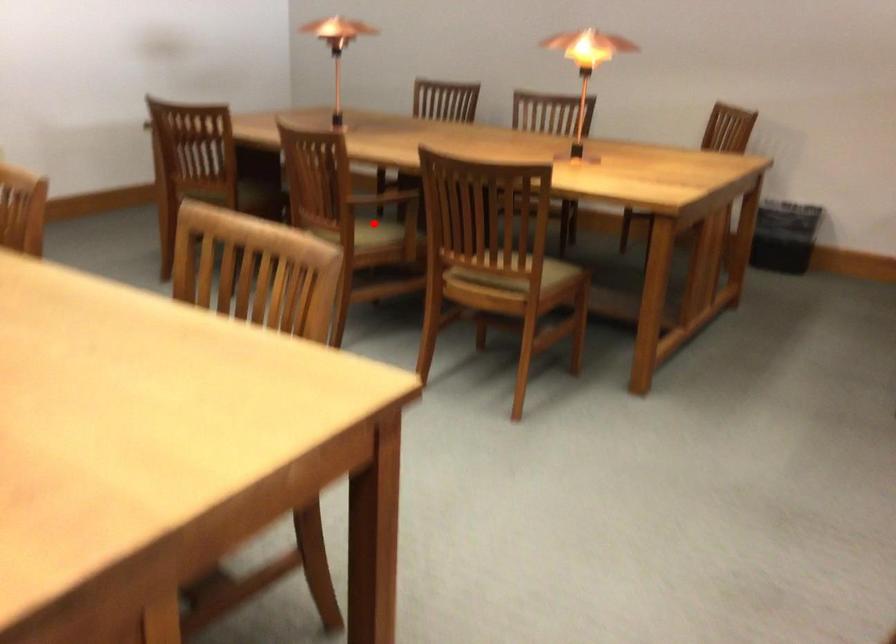
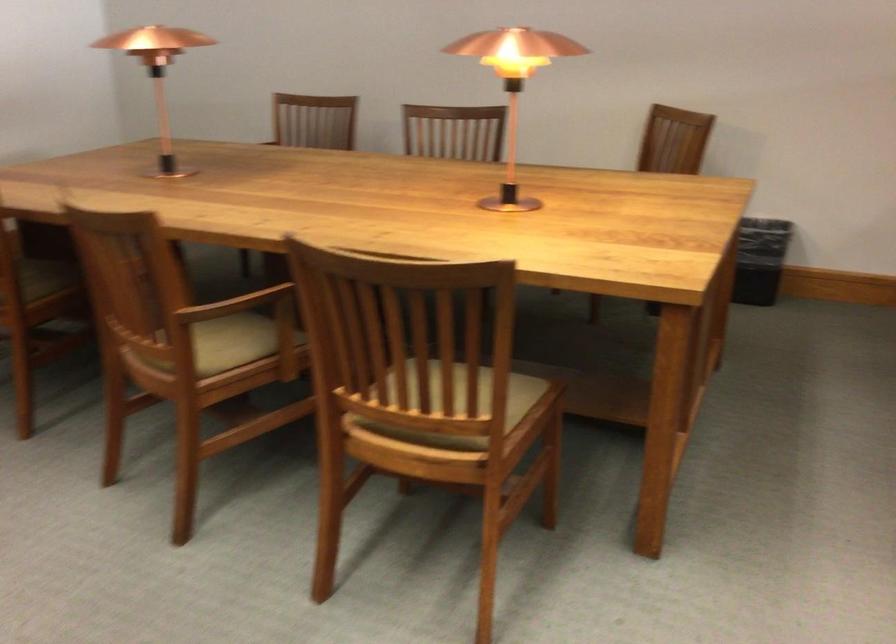
Question: I am providing you with two images of the same scene from different viewpoints. A red point is shown in image1. For the corresponding object point in image2, is it positioned nearer or farther from the camera?

Choices:
 (A) Nearer
 (B) Farther

Answer: (A)